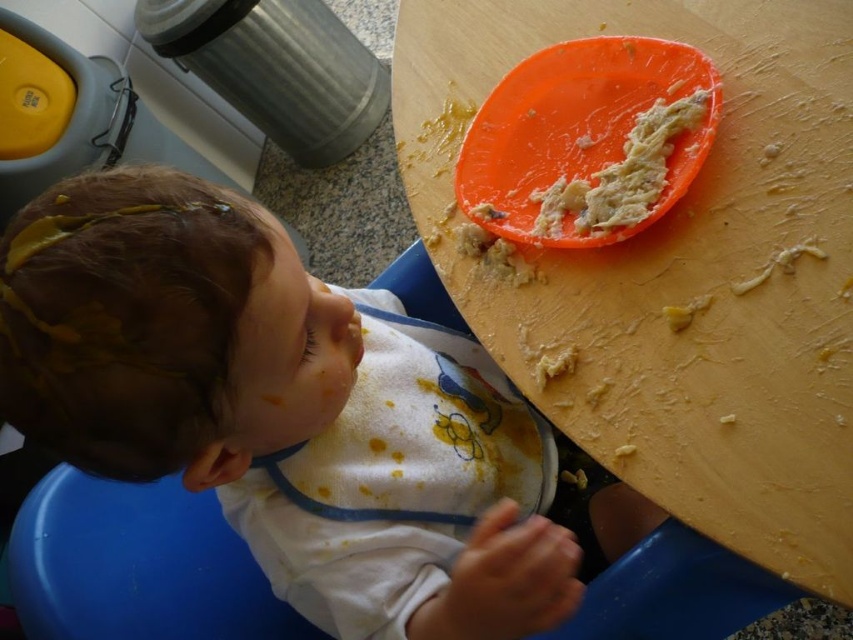
You are a parent trying to place a 40 cm wide toy on the table. Can the orange plastic table at upper right accommodate the toy based on its size?

The orange plastic table at upper right is 50.19 centimeters away from the camera, but this distance does not indicate the table size. The question about the toy fitting requires knowing the table width, which isn not provided in the description. Therefore, it is impossible to determine if the toy will fit.

You are a parent trying to clean up after your child. You need to place the orange plastic plate at upper center into the dishwasher. The dishwasher has a shelf that can only hold items within a 10 inch radius from the edge. If the matte white bib at lower center is currently blocking the area, can you move the bib to make space?

The matte white bib at lower center is 11.32 inches away from the orange plastic plate at upper center. Since the bib is more than 10 inches away from the plate, moving it would require placing it beyond the dishwasher shelfs 10 inch radius limit. Therefore, you cannot safely move the bib to make space without exceeding the shelfs capacity.